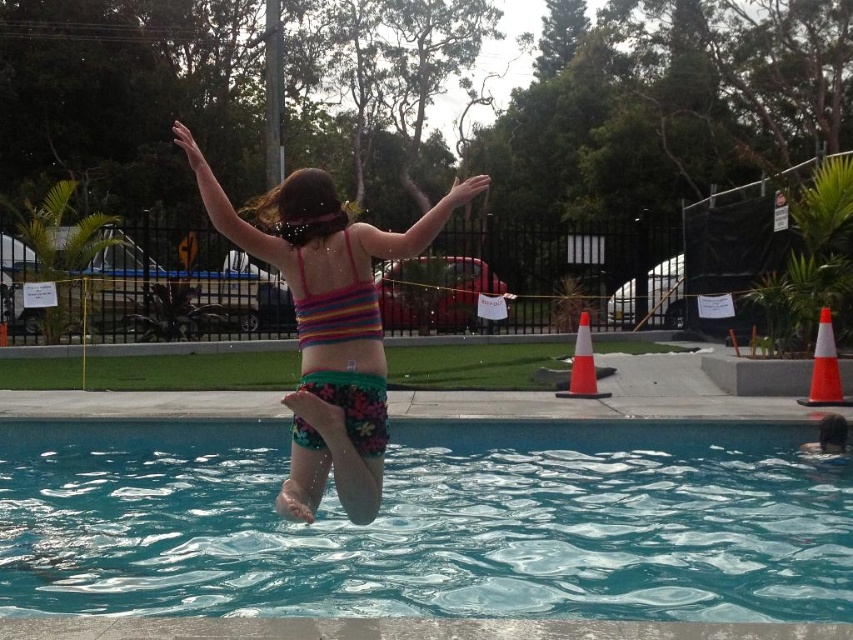
Question: Can you confirm if orange reflective cone at right is positioned below orange/white traffic cone at center?

Choices:
 (A) no
 (B) yes

Answer: (A)

Question: Considering the relative positions of orange reflective cone at right and orange/white traffic cone at center in the image provided, where is orange reflective cone at right located with respect to orange/white traffic cone at center?

Choices:
 (A) left
 (B) right

Answer: (B)

Question: Which of the following is the farthest from the observer?

Choices:
 (A) (827, 314)
 (B) (457, 202)
 (C) (575, 380)
 (D) (115, 547)

Answer: (C)

Question: Does multicolored fabric bikini at center have a lesser width compared to orange/white traffic cone at center?

Choices:
 (A) no
 (B) yes

Answer: (A)

Question: Which of these objects is positioned farthest from the teal glossy water at center?

Choices:
 (A) orange reflective cone at right
 (B) multicolored fabric bikini at center

Answer: (A)

Question: Among these objects, which one is nearest to the camera?

Choices:
 (A) multicolored fabric bikini at center
 (B) teal glossy water at center
 (C) orange/white traffic cone at center
 (D) orange reflective cone at right

Answer: (A)